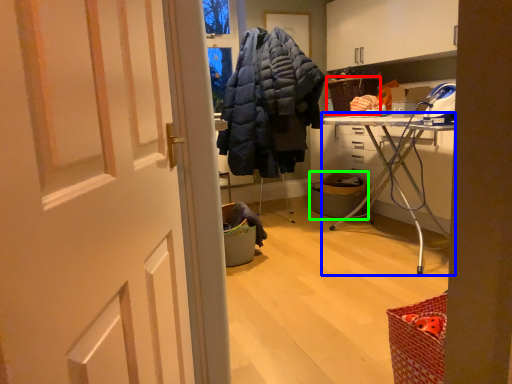
Question: Based on their relative distances, which object is nearer to picnic basket (highlighted by a red box)? Choose from furniture (highlighted by a blue box) and laundry basket (highlighted by a green box).

Choices:
 (A) furniture
 (B) laundry basket

Answer: (B)